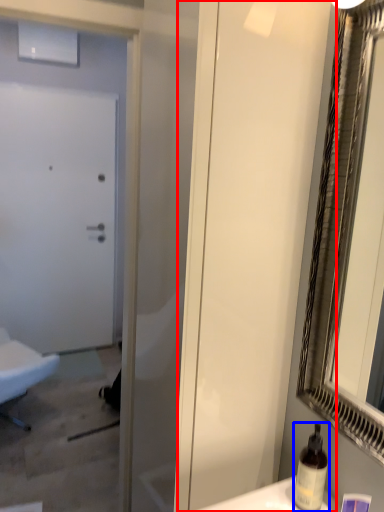
Question: Among these objects, which one is farthest to the camera, screen door (highlighted by a red box) or bottle (highlighted by a blue box)?

Choices:
 (A) screen door
 (B) bottle

Answer: (B)